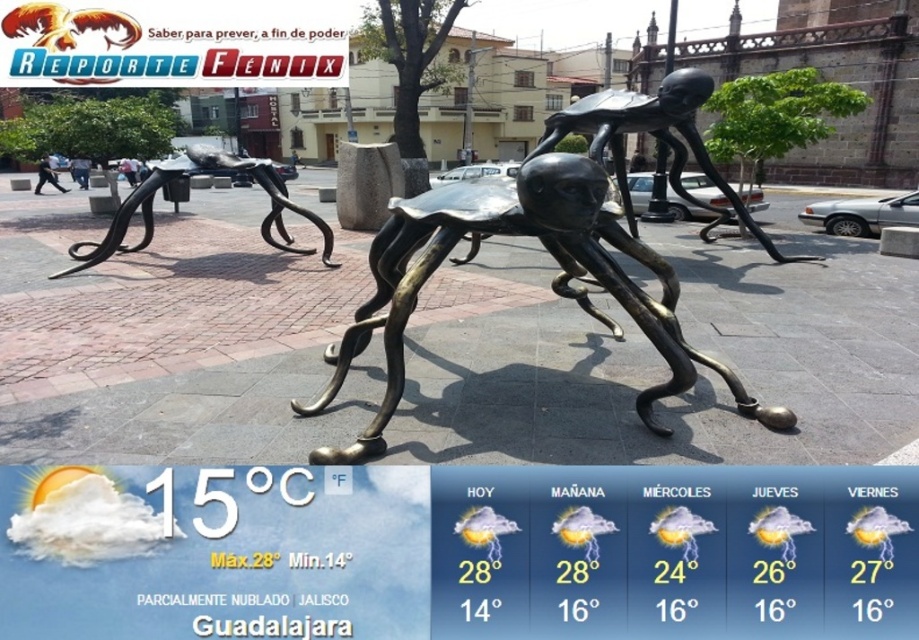
Who is positioned more to the right, metallic spider at center or bronze sculpture at center?

Positioned to the right is metallic spider at center.

Is point (654, 104) positioned after point (189, 166)?

No, it is not.

Is point (529, 161) positioned behind point (245, 173)?

No.

The width and height of the screenshot is (919, 640). In order to click on metallic spider at center in this screenshot , I will do `click(550, 248)`.